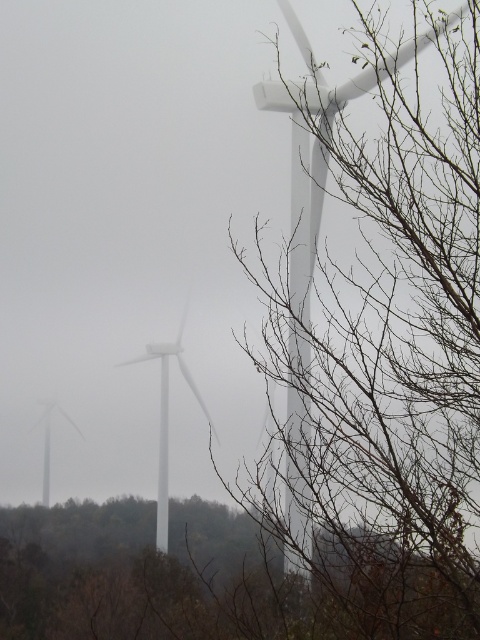
Which is more to the right, bare branches at upper right or brown leafless branches at lower right?

From the viewer's perspective, bare branches at upper right appears more on the right side.

Which of these two, bare branches at upper right or brown leafless branches at lower right, stands shorter?

brown leafless branches at lower right is shorter.

Between point (474, 56) and point (180, 522), which one is positioned in front?

Point (474, 56)

Find the location of `bare branches at upper right`. bare branches at upper right is located at coordinates (379, 333).